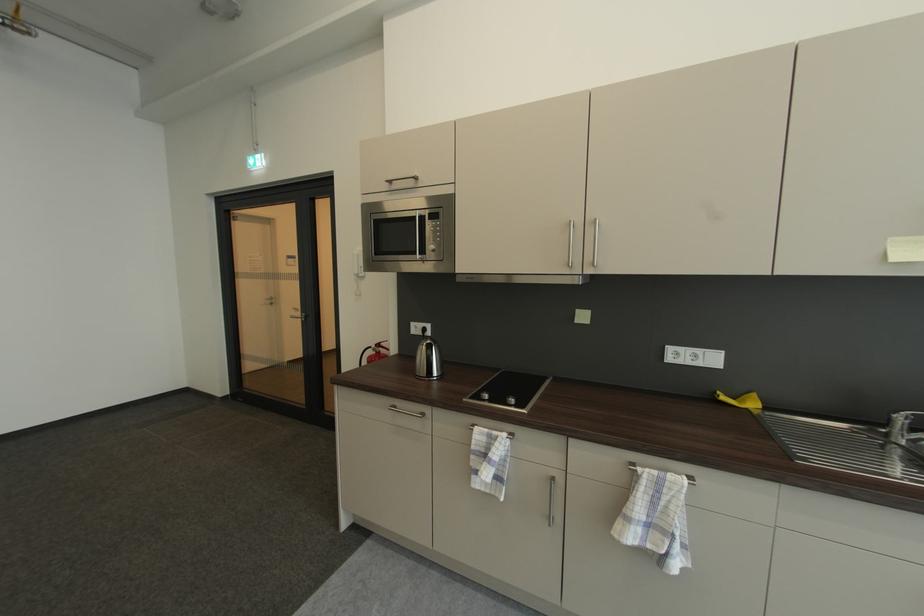
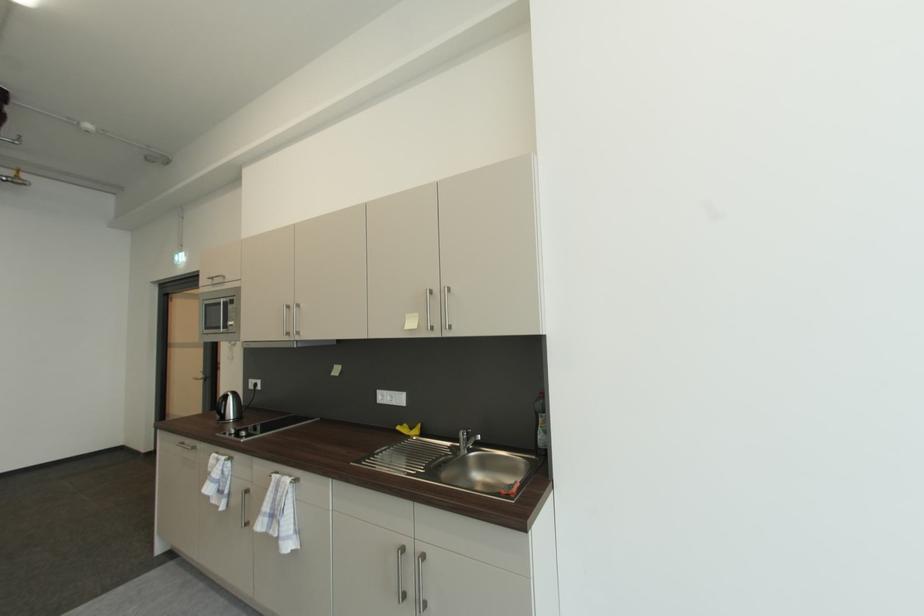
Locate, in the second image, the point that corresponds to (479,448) in the first image.

(215, 471)